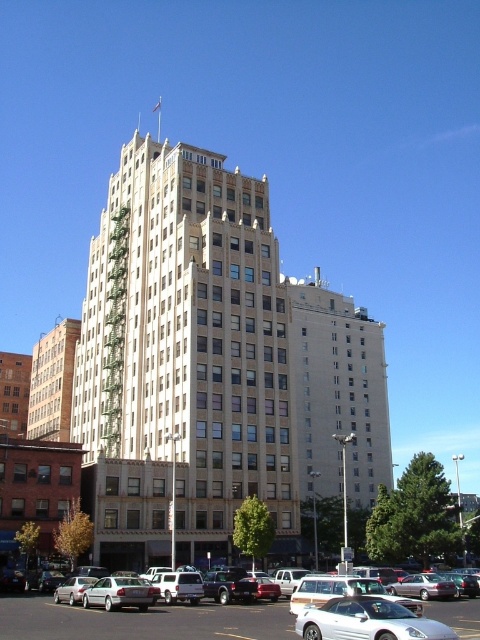
Can you confirm if white smooth building at center is wider than silver metallic sedan at lower center?

Incorrect, white smooth building at center's width does not surpass silver metallic sedan at lower center's.

Is white smooth building at center bigger than silver metallic sedan at lower center?

Indeed, white smooth building at center has a larger size compared to silver metallic sedan at lower center.

Is point (186, 150) more distant than point (6, 604)?

Yes, it is.

Where is `white smooth building at center`? The width and height of the screenshot is (480, 640). white smooth building at center is located at coordinates (188, 346).

Does white smooth building at center have a smaller size compared to silver metallic car at center?

Actually, white smooth building at center might be larger than silver metallic car at center.

Is white smooth building at center to the left of silver metallic car at center from the viewer's perspective?

Correct, you'll find white smooth building at center to the left of silver metallic car at center.

Who is more distant from viewer, (162, 241) or (407, 627)?

The point (162, 241) is behind.

Identify the location of white smooth building at center. (188, 346).

This screenshot has height=640, width=480. What do you see at coordinates (143, 620) in the screenshot?
I see `silver metallic sedan at lower center` at bounding box center [143, 620].

Is silver metallic sedan at lower center positioned behind silver metallic car at center?

Yes.

Locate an element on the screen. This screenshot has width=480, height=640. silver metallic sedan at lower center is located at coordinates (143, 620).